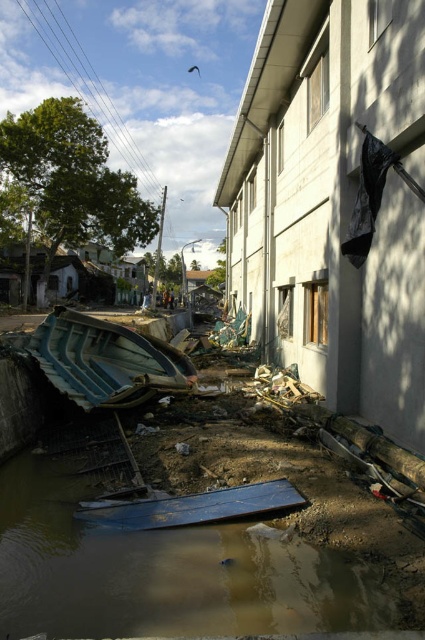
Question: Does brown muddy water at lower left appear under blue fiberglass boat at lower left?

Choices:
 (A) no
 (B) yes

Answer: (B)

Question: Which of the following is the closest to the observer?

Choices:
 (A) brown muddy water at lower left
 (B) blue fiberglass boat at lower left

Answer: (A)

Question: Which point is closer to the camera?

Choices:
 (A) brown muddy water at lower left
 (B) blue fiberglass boat at lower left

Answer: (A)

Question: Can you confirm if brown muddy water at lower left is thinner than blue fiberglass boat at lower left?

Choices:
 (A) yes
 (B) no

Answer: (B)

Question: Which point is closer to the camera?

Choices:
 (A) brown muddy water at lower left
 (B) blue fiberglass boat at lower left

Answer: (A)

Question: Does brown muddy water at lower left appear on the left side of blue fiberglass boat at lower left?

Choices:
 (A) yes
 (B) no

Answer: (B)